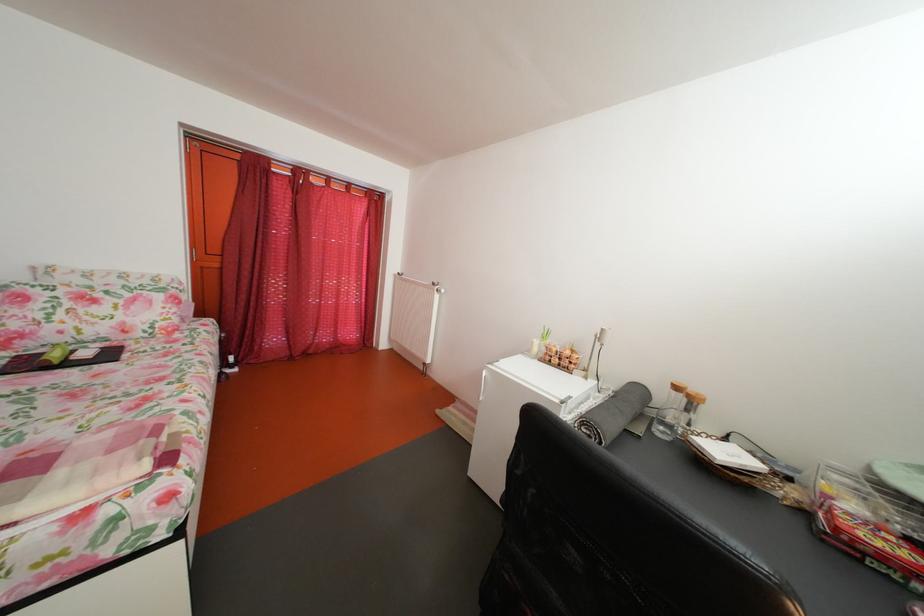
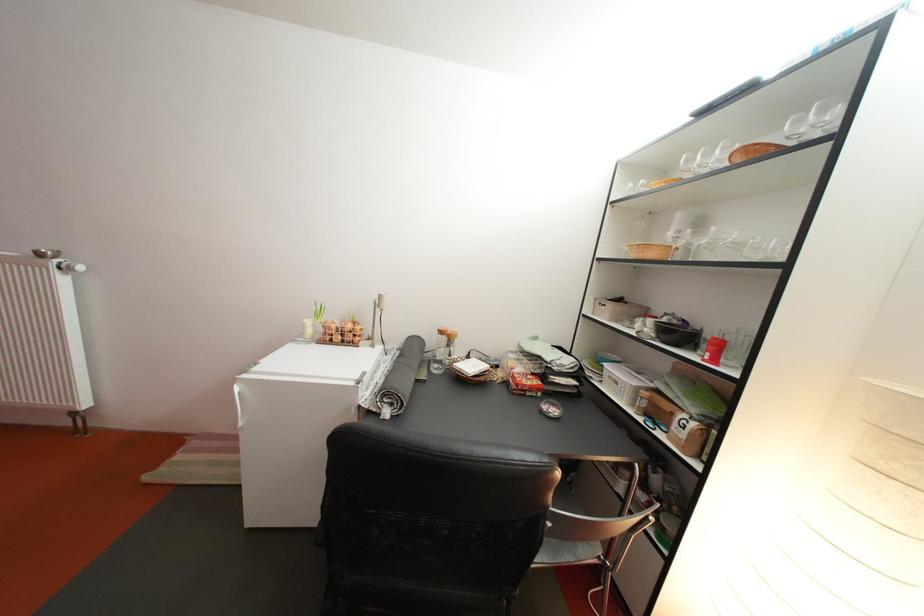
The point at (675, 403) is marked in the first image. Where is the corresponding point in the second image?

(444, 346)